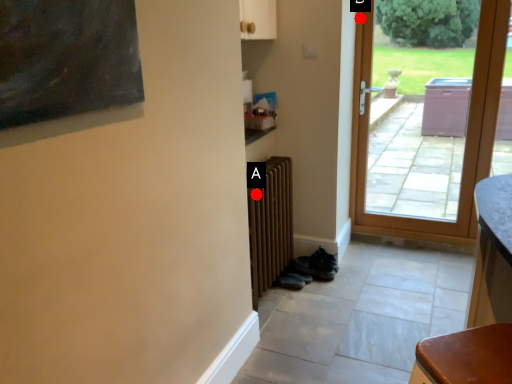
Question: Two points are circled on the image, labeled by A and B beside each circle. Among these points, which one is nearest to the camera?

Choices:
 (A) A is closer
 (B) B is closer

Answer: (A)